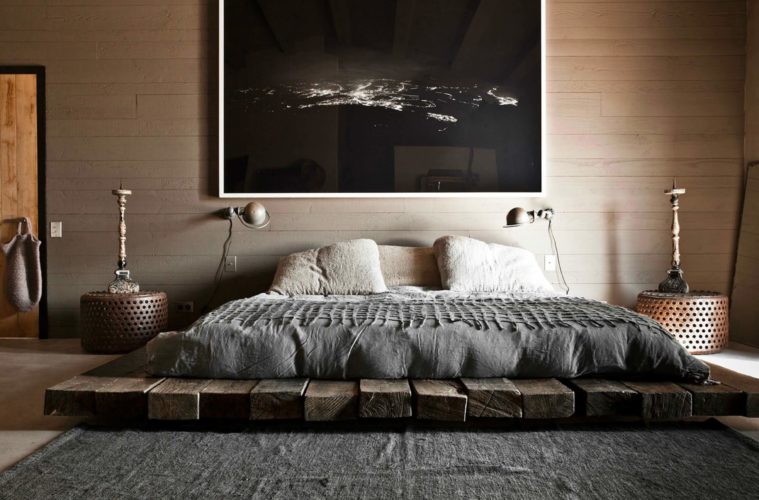
Identify the location of wall. (618, 116).